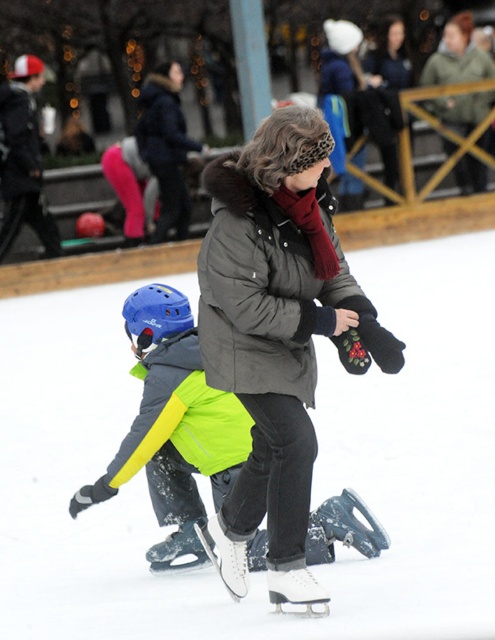
Question: Which point is farther to the camera?

Choices:
 (A) matte black jacket at upper left
 (B) dark green jacket at upper center

Answer: (B)

Question: Can you confirm if matte black jacket at upper left is positioned to the left of dark green jacket at upper center?

Choices:
 (A) no
 (B) yes

Answer: (B)

Question: Which object appears closest to the camera in this image?

Choices:
 (A) matte black jacket at upper left
 (B) dark green jacket at upper center

Answer: (A)

Question: Can you confirm if matte black jacket at upper left is positioned below dark green jacket at upper center?

Choices:
 (A) no
 (B) yes

Answer: (B)

Question: Among these points, which one is nearest to the camera?

Choices:
 (A) (456, 36)
 (B) (38, 138)

Answer: (B)

Question: Is matte black jacket at upper left wider than dark green jacket at upper center?

Choices:
 (A) yes
 (B) no

Answer: (B)